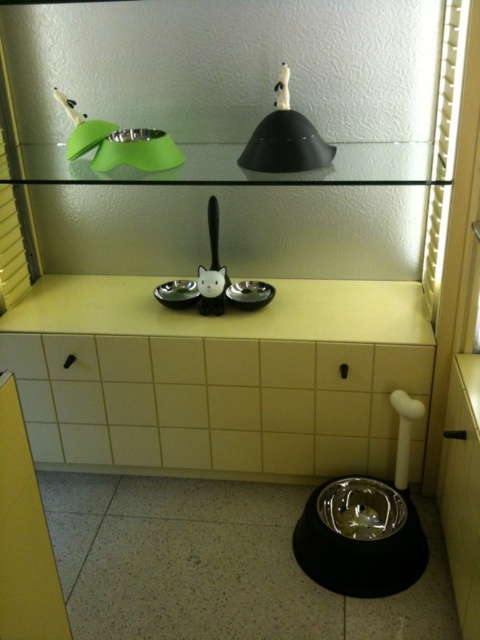
Question: Is yellow matte counter top at center positioned at the back of black matte lampshade at upper center?

Choices:
 (A) no
 (B) yes

Answer: (B)

Question: Considering the relative positions of yellow matte counter top at center and black matte lampshade at upper center in the image provided, where is yellow matte counter top at center located with respect to black matte lampshade at upper center?

Choices:
 (A) above
 (B) below

Answer: (B)

Question: Is yellow matte counter top at center to the left of black matte lampshade at upper center from the viewer's perspective?

Choices:
 (A) no
 (B) yes

Answer: (B)

Question: Which of the following is the closest to the observer?

Choices:
 (A) (289, 321)
 (B) (283, 125)

Answer: (B)